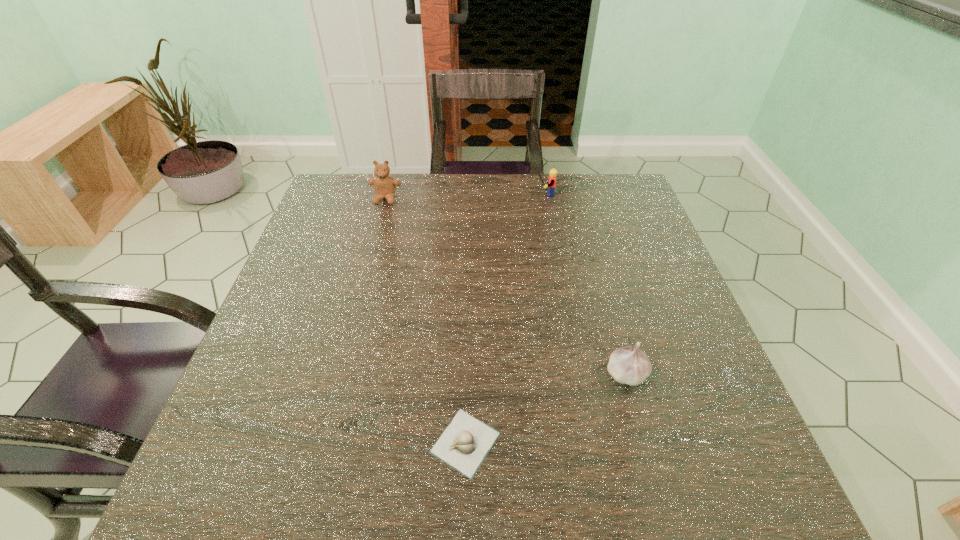
I want to click on vacant area that lies between the left garlic and the third farthest object, so click(546, 408).

Image resolution: width=960 pixels, height=540 pixels. Find the location of `free point between the leftmost object and the Lego`. free point between the leftmost object and the Lego is located at coordinates (465, 197).

Where is `vacant space that's between the shorter garlic and the second object from right to left`? The image size is (960, 540). vacant space that's between the shorter garlic and the second object from right to left is located at coordinates (504, 319).

The height and width of the screenshot is (540, 960). Identify the location of free space between the Lego and the third tallest object. (585, 284).

Where is `object that is the closest to the Lego`? Image resolution: width=960 pixels, height=540 pixels. object that is the closest to the Lego is located at coordinates (384, 185).

Where is `the third closest object to the second object from right to left`? Image resolution: width=960 pixels, height=540 pixels. the third closest object to the second object from right to left is located at coordinates (464, 444).

You are a GUI agent. You are given a task and a screenshot of the screen. Output one action in this format:
    pyautogui.click(x=<x>, y=<y>)
    Task: Click on the free space that satisfies the following two spatial constraints: 1. on the face of the third object from right to left; 2. on the left side of the teddy bear
    The height and width of the screenshot is (540, 960).
    Given the screenshot: What is the action you would take?
    pyautogui.click(x=320, y=443)

Image resolution: width=960 pixels, height=540 pixels. In order to click on free space that satisfies the following two spatial constraints: 1. on the front-facing side of the third object from left to right; 2. on the back side of the second shortest object in this screenshot , I will do `click(576, 374)`.

The image size is (960, 540). I want to click on free space that satisfies the following two spatial constraints: 1. on the front-facing side of the Lego; 2. on the face of the leftmost object, so click(x=543, y=199).

At what (x,y) coordinates should I click in order to perform the action: click on vacant region that satisfies the following two spatial constraints: 1. on the face of the second shortest object; 2. on the right side of the leftmost object. Please return your answer as a coordinate pair (x, y). This screenshot has width=960, height=540. Looking at the image, I should click on (338, 374).